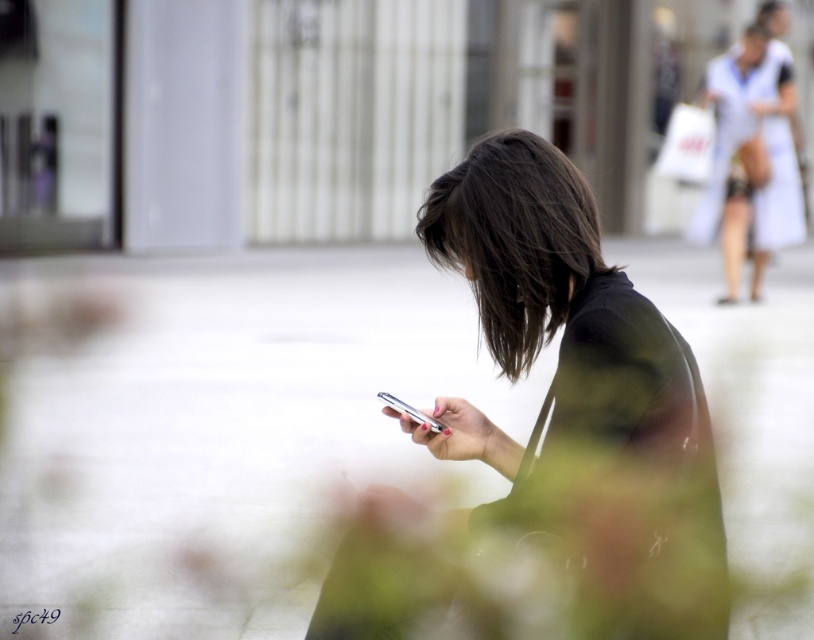
Between point (775, 160) and point (435, 432), which one is positioned in front?

Point (435, 432)

Between white cotton dress at upper right and silver metallic smartphone at center, which one appears on the right side from the viewer's perspective?

white cotton dress at upper right is more to the right.

Image resolution: width=814 pixels, height=640 pixels. Identify the location of white cotton dress at upper right. (751, 160).

Can you confirm if matte black phone at center is positioned below dark brown silky hair at center?

Yes.

Does matte black phone at center have a greater width compared to dark brown silky hair at center?

Correct, the width of matte black phone at center exceeds that of dark brown silky hair at center.

Is point (615, 332) positioned before point (427, 216)?

Yes, point (615, 332) is closer to viewer.

This screenshot has width=814, height=640. What are the coordinates of `matte black phone at center` in the screenshot? It's located at (559, 291).

Which is more to the right, silver metallic smartphone at center or blacksmoothtext at center?

From the viewer's perspective, silver metallic smartphone at center appears more on the right side.

Is point (405, 406) more distant than point (50, 609)?

No, it is not.

Find the location of a particular element. silver metallic smartphone at center is located at coordinates (410, 412).